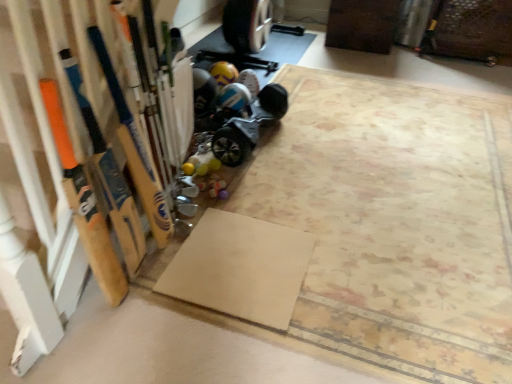
Locate an element on the screen. empty space that is to the right of blue metallic hoverboard at lower center is located at coordinates (316, 143).